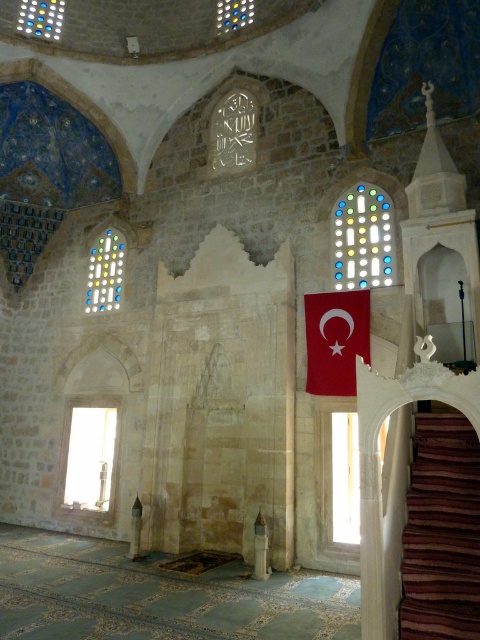
Who is positioned more to the left, multicolored stained glass at upper center or multicolored stained glass at upper left?

Positioned to the left is multicolored stained glass at upper left.

Which is in front, point (334, 225) or point (93, 272)?

Point (334, 225) is in front.

Locate an element on the screen. This screenshot has height=640, width=480. multicolored stained glass at upper center is located at coordinates (362, 237).

Can you confirm if red matte flag at center is taller than multicolored stained glass at upper center?

Incorrect, red matte flag at center's height is not larger of multicolored stained glass at upper center's.

Describe the element at coordinates (336, 339) in the screenshot. This screenshot has height=640, width=480. I see `red matte flag at center` at that location.

Find the location of a particular element. red matte flag at center is located at coordinates (336, 339).

Which of these two, red matte flag at center or multicolored stained glass at upper left, stands taller?

multicolored stained glass at upper left is taller.

Is red matte flag at center thinner than multicolored stained glass at upper left?

Incorrect, red matte flag at center's width is not less than multicolored stained glass at upper left's.

Locate an element on the screen. red matte flag at center is located at coordinates (336, 339).